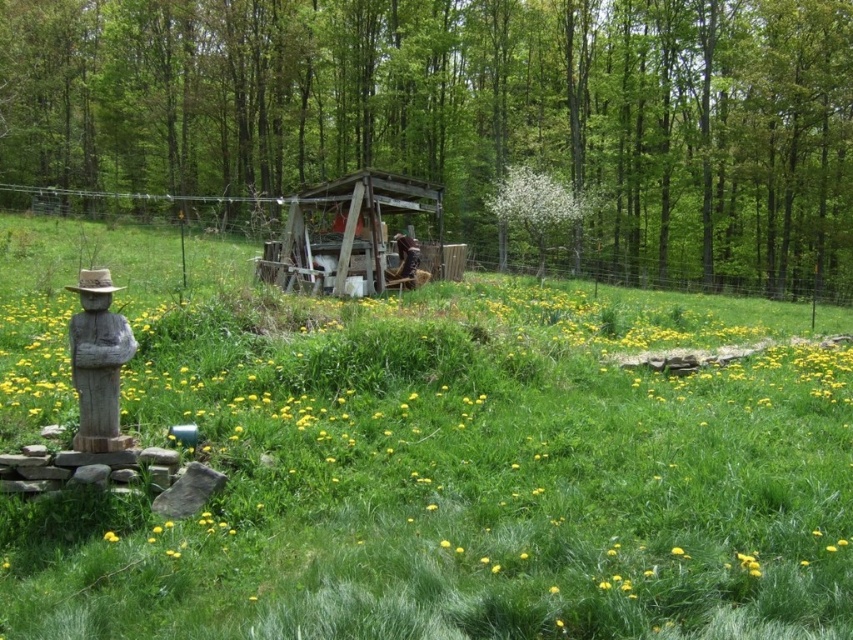
You are a photographer wanting to capture both the wooden statue at left and the yellow matte flower at center in a single frame. Which object should you position closer to the center of your camera viewfinder to ensure both are included?

To include both the wooden statue at left and the yellow matte flower at center in the frame, position the yellow matte flower at center closer to the center of the camera viewfinder since the wooden statue at left is already to the left of it.

You are planning to set up a small tent in the image. The tent requires an area wider than the wooden hut at center. Can you determine if the green grass at center has enough width for the tent?

The green grass at center might be wider than wooden hut at center, so there is a possibility that the green grass at center has enough width for the tent.

You are a gardener planning to plant a new flower bed. You see the wooden statue at left and the yellow matte flower at center. Which object is closer to the ground?

The yellow matte flower at center is closer to the ground because the wooden statue at left is positioned over it.